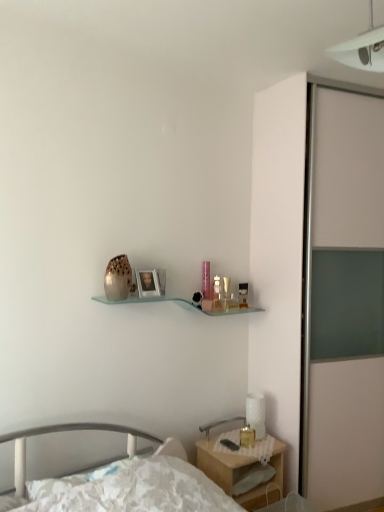
Where is `vacant space to the right of translucent glass candle at bedside`? vacant space to the right of translucent glass candle at bedside is located at coordinates (265, 439).